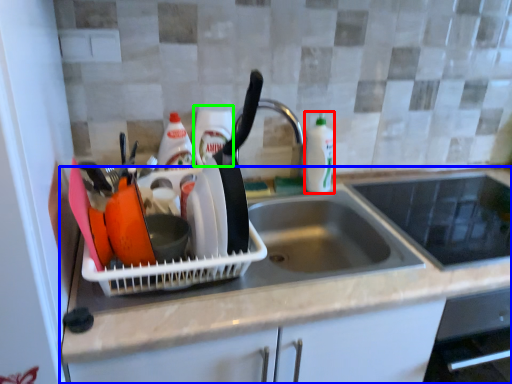
Question: Which object is the closest to the bottle (highlighted by a red box)? Choose among these: countertop (highlighted by a blue box) or bottle (highlighted by a green box).

Choices:
 (A) countertop
 (B) bottle

Answer: (B)